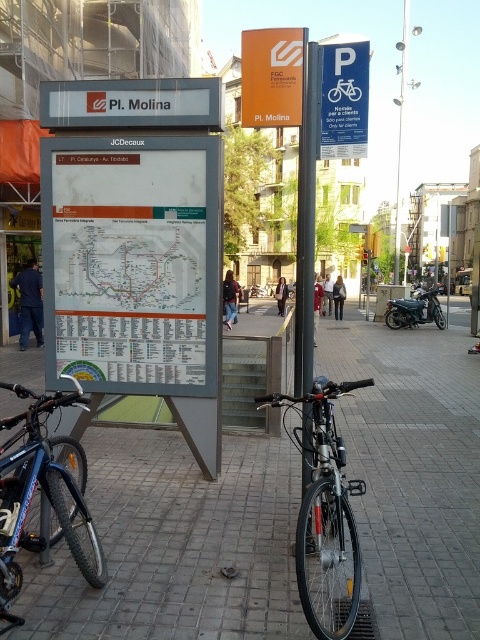
You are a cyclist arriving at Pl. Molina station and see the silver metallic bicycle at center and the blue plastic parking sign at upper right. According to the scene, which object is closer to you?

The silver metallic bicycle at center is closer to you because it is in front of the blue plastic parking sign at upper right.

You are standing at the station Pl. Molina and want to take a photo of the signboard with the map of the Barcelona metro system. The camera you are using has a maximum focus range of 3 meters. Will the point at coordinates point (322, 477) be in focus if you focus on the signboard?

The point at coordinates point (322, 477) is 3.05 meters from the camera, which is slightly beyond the maximum focus range of 3 meters. Therefore, the point will not be in focus if you focus on the signboard.